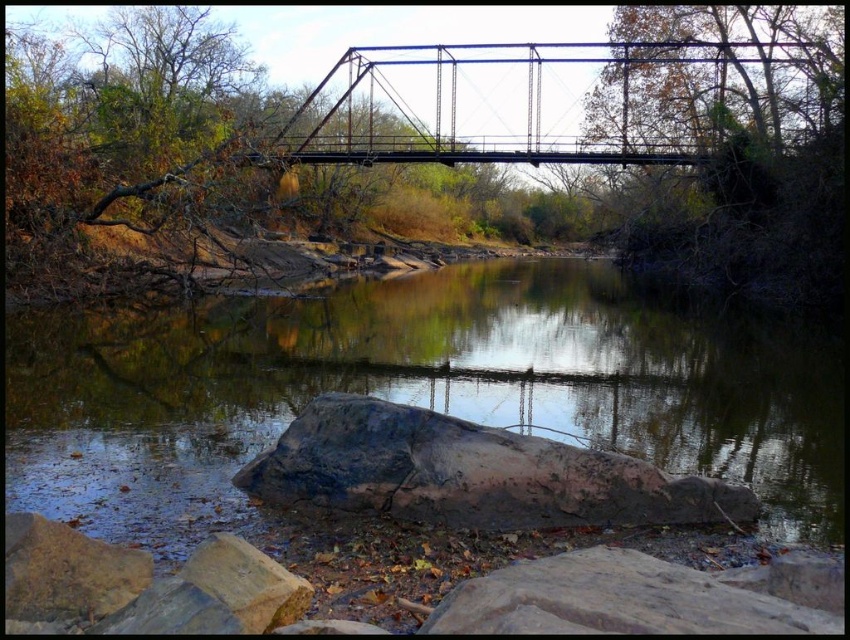
Is metallic bridge at upper center closer to camera compared to gray rough rock at lower center?

That is False.

Does point (477, 93) come behind point (314, 465)?

Yes, it is.

Is point (570, 97) positioned after point (658, 508)?

That is True.

Identify the location of metallic bridge at upper center. (536, 100).

Between point (75, 342) and point (707, 504), which one is positioned behind?

The point (75, 342) is behind.

Find the location of a particular element. smooth brown water at center is located at coordinates (411, 390).

Is point (388, 337) positioned after point (717, 518)?

Yes, it is behind point (717, 518).

Where is `smooth brown water at center`? Image resolution: width=850 pixels, height=640 pixels. smooth brown water at center is located at coordinates (411, 390).

Can you confirm if smooth brown water at center is smaller than metallic bridge at upper center?

Indeed, smooth brown water at center has a smaller size compared to metallic bridge at upper center.

This screenshot has height=640, width=850. What do you see at coordinates (411, 390) in the screenshot?
I see `smooth brown water at center` at bounding box center [411, 390].

You are a GUI agent. You are given a task and a screenshot of the screen. Output one action in this format:
    pyautogui.click(x=<x>, y=<y>)
    Task: Click on the smooth brown water at center
    The height and width of the screenshot is (640, 850).
    Given the screenshot: What is the action you would take?
    pyautogui.click(x=411, y=390)